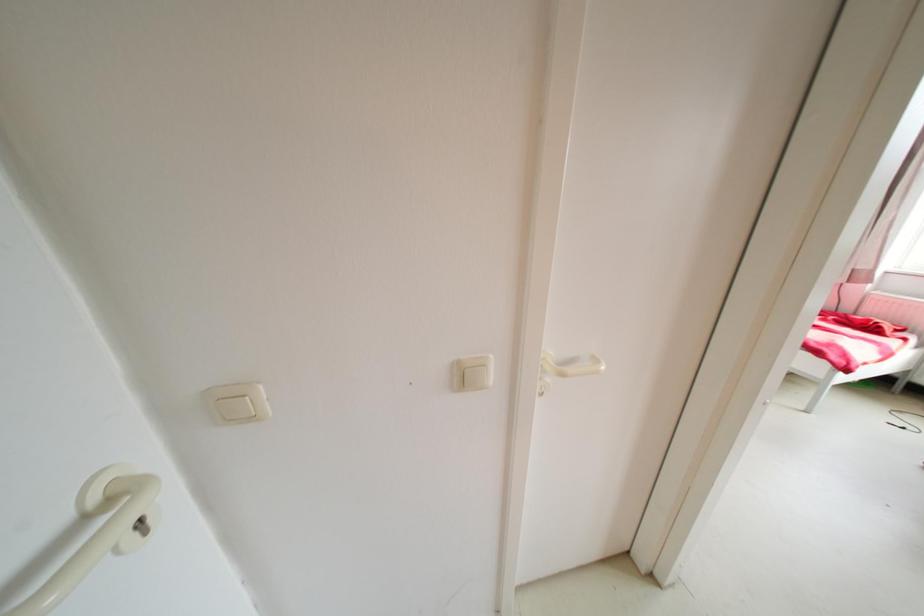
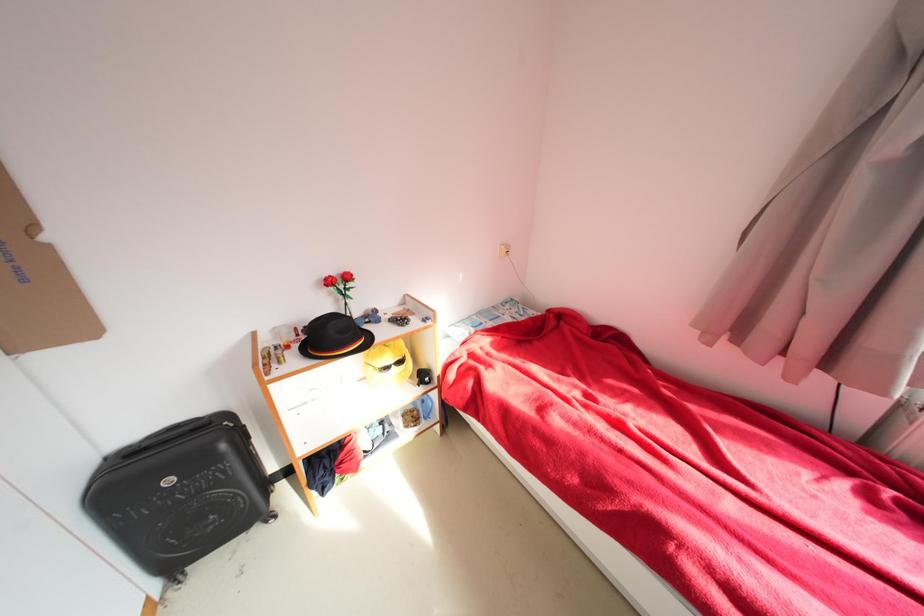
The images are taken continuously from a first-person perspective. In which direction are you moving?

The movement direction of the cameraman is right, forward.